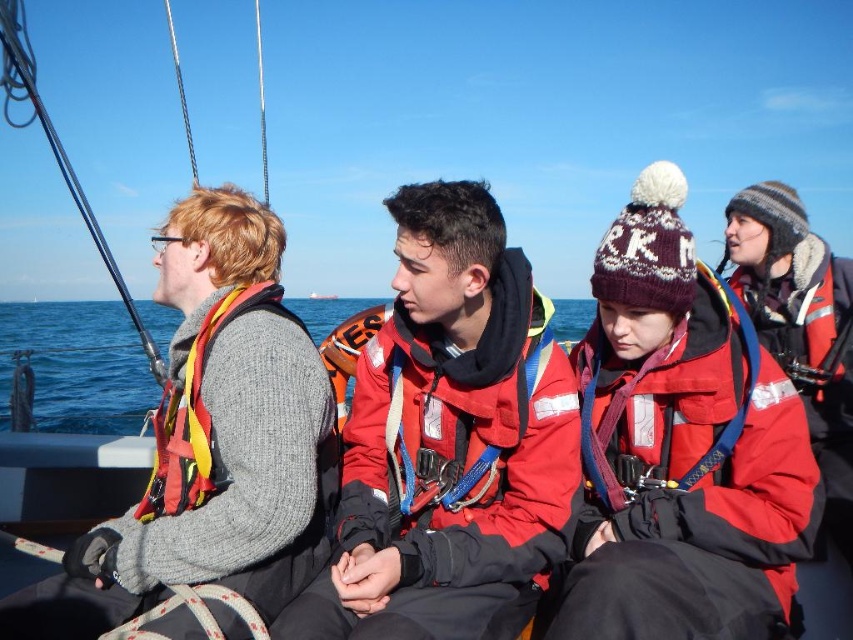
Does red matte jacket at center have a smaller size compared to matte red life jacket at right?

Yes.

Does red matte jacket at center appear under matte red life jacket at right?

Indeed, red matte jacket at center is positioned under matte red life jacket at right.

Who is more forward, (515,625) or (836,262)?

Point (515,625) is more forward.

Where is `red matte jacket at center`? The image size is (853, 640). red matte jacket at center is located at coordinates (450, 442).

Does red matte jacket at center have a lesser height compared to knitted gray sweater at left?

Yes.

Does red matte jacket at center have a smaller size compared to knitted gray sweater at left?

Correct, red matte jacket at center occupies less space than knitted gray sweater at left.

Where is `red matte jacket at center`? red matte jacket at center is located at coordinates (450, 442).

In order to click on red matte jacket at center in this screenshot , I will do `click(450, 442)`.

Is knitted gray sweater at left further to the viewer compared to matte red life jacket at right?

That is False.

Which is in front, point (224, 396) or point (817, 284)?

Point (224, 396)

Who is more forward, (285, 328) or (786, 291)?

Point (285, 328) is in front.

You are a GUI agent. You are given a task and a screenshot of the screen. Output one action in this format:
    pyautogui.click(x=<x>, y=<y>)
    Task: Click on the knitted gray sweater at left
    
    Given the screenshot: What is the action you would take?
    pyautogui.click(x=212, y=442)